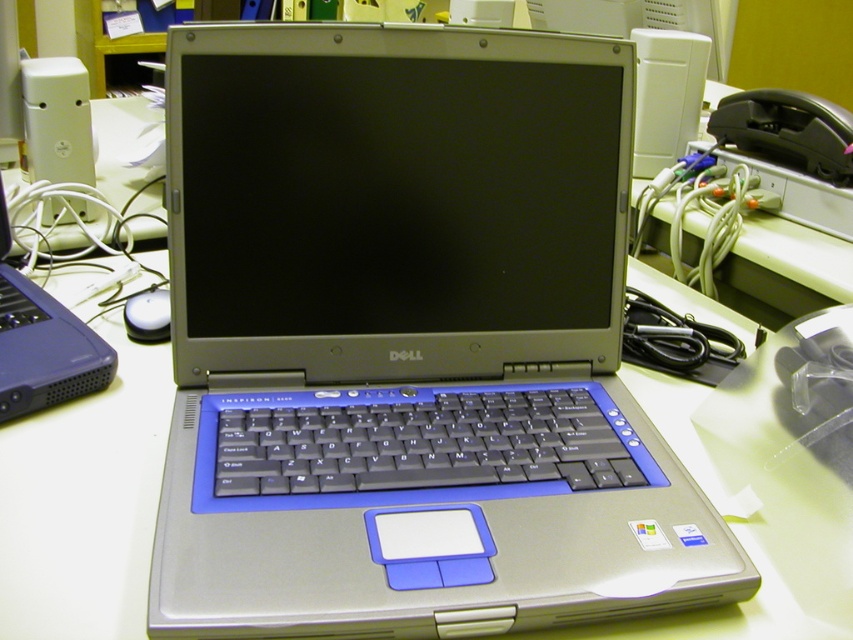
Question: Is matte black laptop at left positioned behind white glossy mouse at center?

Choices:
 (A) yes
 (B) no

Answer: (B)

Question: Which of these objects is positioned farthest from the black plastic keyboard at center?

Choices:
 (A) matte black laptop at left
 (B) silver metallic laptop at center
 (C) white glossy mouse at center
 (D) silver metallic computer monitor at center

Answer: (C)

Question: Is silver metallic laptop at center wider than white glossy mouse at center?

Choices:
 (A) no
 (B) yes

Answer: (B)

Question: Estimate the real-world distances between objects in this image. Which object is closer to the silver metallic computer monitor at center?

Choices:
 (A) white glossy mouse at center
 (B) silver metallic laptop at center

Answer: (B)

Question: Does silver metallic computer monitor at center appear over black plastic keyboard at center?

Choices:
 (A) no
 (B) yes

Answer: (B)

Question: Which object is closer to the camera taking this photo?

Choices:
 (A) silver metallic laptop at center
 (B) black plastic keyboard at center
 (C) silver metallic computer monitor at center

Answer: (A)